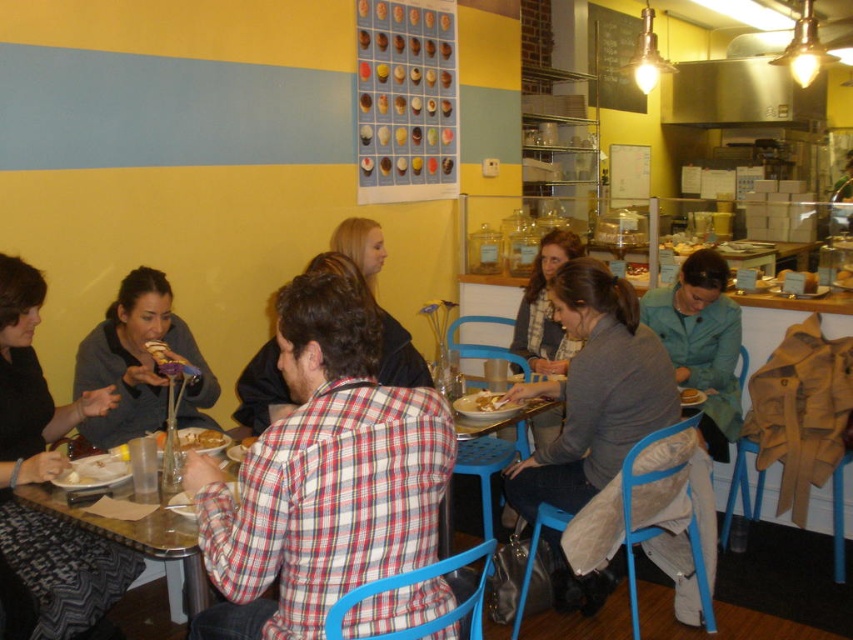
You are a photographer standing at the center of the cafe, and you want to take a photo that includes both the point at the table labeled point (740, 314) and the point at the chair labeled point (482, 392). Which of these two points will appear closer to the camera in the photo?

Point (482, 392) will appear closer to the camera in the photo because it is closer to the photographer than point (740, 314), which is further away.

You are a customer entering the cozy cafe and see the matte black jacket at left. If you want to hang your coat on the nearest available hook, which object should you place it near?

The matte black jacket at left is located at point (44, 481), so you should place your coat near the nearest available hook closest to that location.

From the picture: You are a customer at the cafe and want to place your phone on the table. The table has a white matte plate at center and a green fabric jacket at right. Which object is taller, making it a better option to place the phone?

The green fabric jacket at right is taller than the white matte plate at center, so placing the phone there would be more stable.